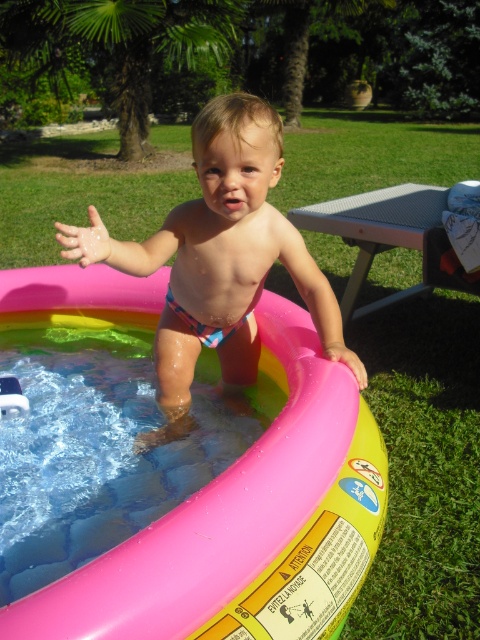
You are a parent setting up a play area for your child. You have a pink rubber tub at center and a matte pink inflatable pool at center. Which object should you fill with water if you want the child to play in it?

The matte pink inflatable pool at center should be filled with water since it is positioned above the pink rubber tub at center, indicating it is the intended container for the child to play in.

You are a parent trying to ensure your child stays within a safe distance from the picnic table. According to the image, how far apart are the multicolored fabric shorts at center and the gray metal picnic table at right?

The multicolored fabric shorts at center is 1.56 meters away from the gray metal picnic table at right.